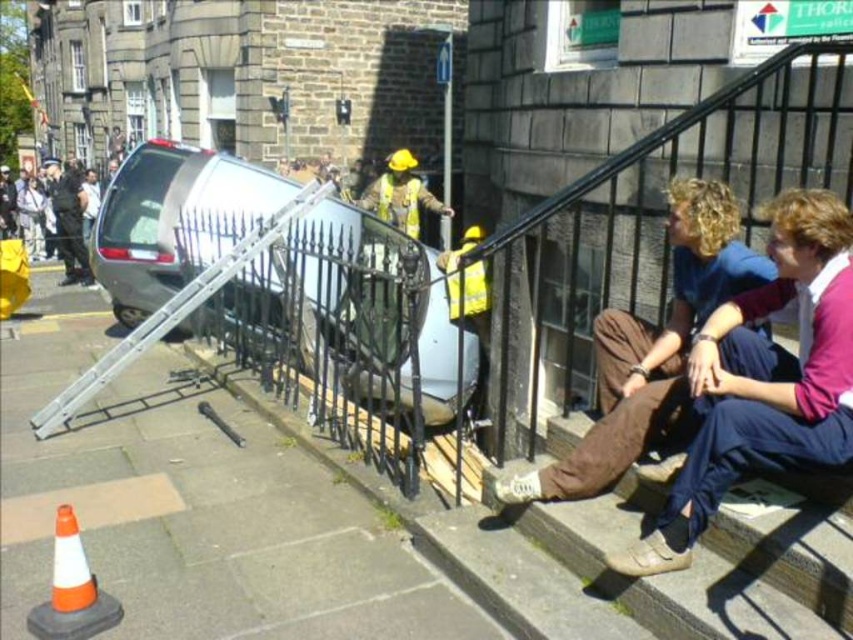
Is gray concrete pavement at lower left to the right of brown cotton pants at lower right from the viewer's perspective?

Incorrect, gray concrete pavement at lower left is not on the right side of brown cotton pants at lower right.

Who is positioned more to the left, gray concrete pavement at lower left or brown cotton pants at lower right?

gray concrete pavement at lower left is more to the left.

Does point (285, 556) come behind point (676, 401)?

Yes, it is behind point (676, 401).

Find the location of `gray concrete pavement at lower left`. gray concrete pavement at lower left is located at coordinates (198, 512).

Which of these two, silver metallic van at center or orange/white plastic traffic cone at lower left, stands taller?

Standing taller between the two is silver metallic van at center.

Is silver metallic van at center bigger than orange/white plastic traffic cone at lower left?

Correct, silver metallic van at center is larger in size than orange/white plastic traffic cone at lower left.

Between point (146, 170) and point (109, 627), which one is positioned behind?

Positioned behind is point (146, 170).

Image resolution: width=853 pixels, height=640 pixels. I want to click on silver metallic van at center, so click(173, 220).

Between point (735, 602) and point (688, 272), which one is positioned behind?

Positioned behind is point (688, 272).

Is point (780, 627) positioned before point (520, 480)?

Yes, it is.

Describe the element at coordinates (698, 557) in the screenshot. I see `brown fabric stairs at lower right` at that location.

This screenshot has width=853, height=640. In order to click on brown fabric stairs at lower right in this screenshot , I will do `click(698, 557)`.